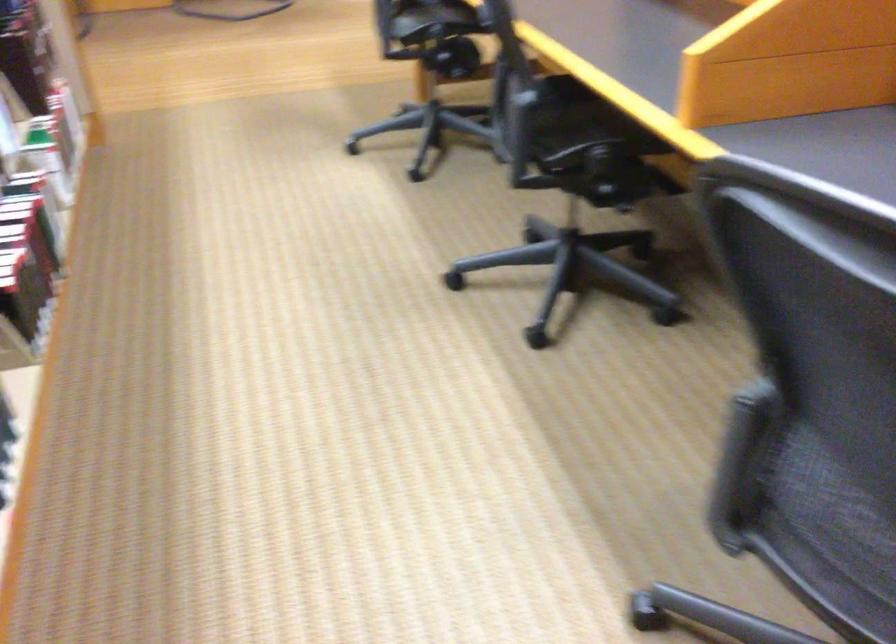
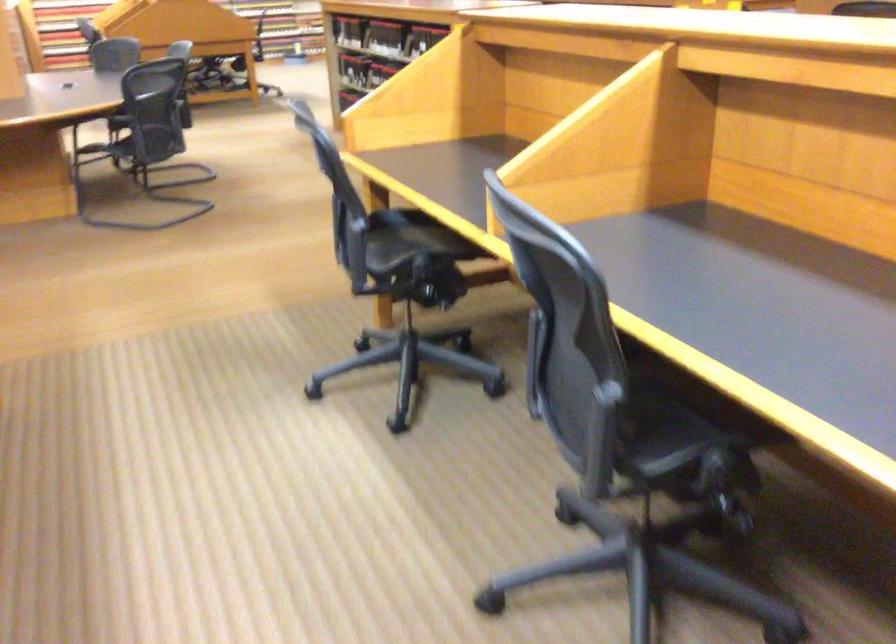
Question: The images are taken continuously from a first-person perspective. In which direction is your viewpoint rotating?

Choices:
 (A) Left
 (B) Right
 (C) Up
 (D) Down

Answer: (C)